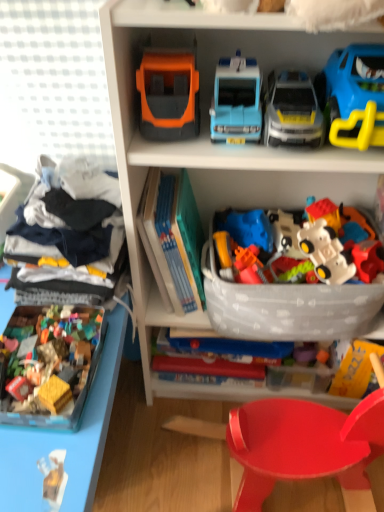
Question: From the image's perspective, is light blue plastic toy car at upper center, acting as the 3th toy starting from the left, positioned above or below orange matte truck at upper center, placed as the second toy when sorted from left to right?

Choices:
 (A) above
 (B) below

Answer: (B)

Question: Based on their sizes in the image, would you say light blue plastic toy car at upper center, acting as the 3th toy starting from the left, is bigger or smaller than orange matte truck at upper center, the 5th toy in the right-to-left sequence?

Choices:
 (A) big
 (B) small

Answer: (B)

Question: Which is nearer to the white plastic toy car at center, the 2th toy viewed from the right?

Choices:
 (A) multicolored plastic building blocks at lower left, the sixth toy in the right-to-left sequence
 (B) white cotton shirt at left
 (C) shiny plastic chair at lower center
 (D) orange matte truck at upper center, the 5th toy in the right-to-left sequence
 (E) plastic toy blocks at lower left

Answer: (C)

Question: Which object is the closest to the white cotton shirt at left?

Choices:
 (A) orange matte truck at upper center, the 5th toy in the right-to-left sequence
 (B) multicolored plastic building blocks at lower left, the sixth toy in the right-to-left sequence
 (C) plastic toy blocks at lower left
 (D) white plastic toy car at center, the 2th toy viewed from the right
 (E) blue plastic car at upper right, arranged as the 6th toy when viewed from the left

Answer: (B)